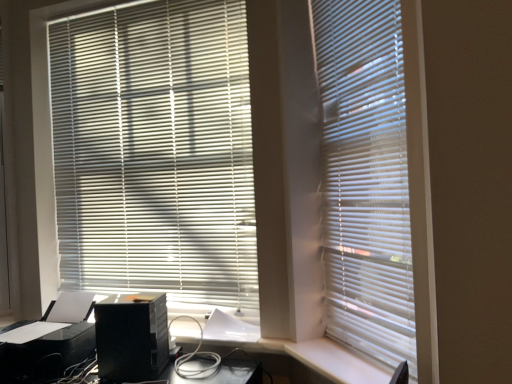
Question: Is point (335, 21) positioned closer to the camera than point (159, 307)?

Choices:
 (A) closer
 (B) farther

Answer: (A)

Question: From the image's perspective, is white matte blinds at center, the 1th window blind when ordered from front to back, located above or below black plastic computer tower at lower left?

Choices:
 (A) below
 (B) above

Answer: (B)

Question: Based on their relative distances, which object is nearer to the white matte blinds at center, which is the 1th window blind from right to left?

Choices:
 (A) white plastic screen door at left
 (B) black plastic printer at lower left
 (C) black plastic computer tower at lower left
 (D) white matte blinds at center, placed as the 2th window blind when sorted from front to back

Answer: (D)

Question: Which object is positioned farthest from the white matte blinds at center, the 1th window blind when ordered from front to back?

Choices:
 (A) white matte blinds at center, the 1th window blind from the back
 (B) black plastic computer tower at lower left
 (C) white plastic screen door at left
 (D) black plastic printer at lower left

Answer: (C)